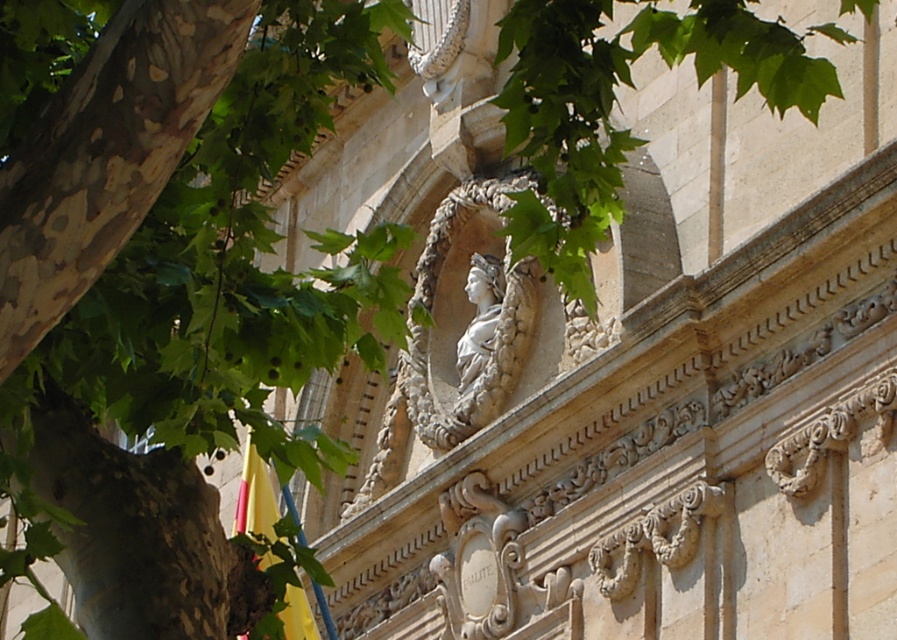
Question: Which of the following is the farthest from the observer?

Choices:
 (A) white marble bust at center
 (B) white stone bust at center
 (C) yellow fabric at lower left

Answer: (A)

Question: Which of the following is the closest to the observer?

Choices:
 (A) white marble bust at center
 (B) yellow fabric at lower left
 (C) white stone bust at center

Answer: (B)

Question: Which object is the farthest from the yellow fabric at lower left?

Choices:
 (A) white marble bust at center
 (B) white stone bust at center

Answer: (A)

Question: Considering the relative positions of yellow fabric at lower left and white marble bust at center in the image provided, where is yellow fabric at lower left located with respect to white marble bust at center?

Choices:
 (A) right
 (B) left

Answer: (B)

Question: Can you confirm if white stone bust at center is positioned to the right of white marble bust at center?

Choices:
 (A) no
 (B) yes

Answer: (A)

Question: Can you confirm if yellow fabric at lower left is positioned to the left of white marble bust at center?

Choices:
 (A) yes
 (B) no

Answer: (A)